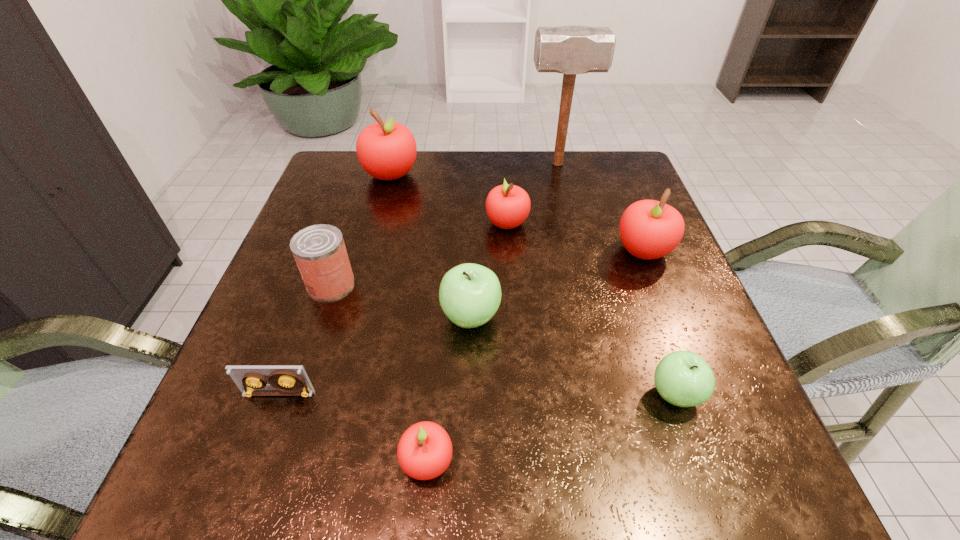
You are a GUI agent. You are given a task and a screenshot of the screen. Output one action in this format:
    pyautogui.click(x=<x>, y=<y>)
    Task: Click on the free space between the farthest red apple and the fifth farthest apple
    The image size is (960, 540).
    Given the screenshot: What is the action you would take?
    [x=533, y=284]

You are a GUI agent. You are given a task and a screenshot of the screen. Output one action in this format:
    pyautogui.click(x=<x>, y=<y>)
    Task: Click on the vacant area that lies between the second red apple from left to right and the fifth farthest apple
    The height and width of the screenshot is (540, 960).
    Given the screenshot: What is the action you would take?
    pyautogui.click(x=551, y=428)

This screenshot has height=540, width=960. I want to click on vacant area that lies between the can and the right green apple, so click(x=503, y=339).

This screenshot has width=960, height=540. Identify the location of vacant space that's between the left green apple and the can. (400, 300).

Where is `free space between the videotape and the smaller green apple`? This screenshot has height=540, width=960. free space between the videotape and the smaller green apple is located at coordinates (477, 394).

Select which object appears as the third closest to the second smallest red apple. Please provide its 2D coordinates. Your answer should be formatted as a tuple, i.e. [(x, y)], where the tuple contains the x and y coordinates of a point satisfying the conditions above.

[(649, 229)]

This screenshot has width=960, height=540. In order to click on object that is the third closest one to the leftmost apple in this screenshot , I will do `click(571, 49)`.

Where is `the fifth closest apple to the can`? the fifth closest apple to the can is located at coordinates (649, 229).

Find the location of `apple that is the fourth nearest to the second red apple from right to left`. apple that is the fourth nearest to the second red apple from right to left is located at coordinates (683, 378).

Locate which red apple ranks second in proximity to the shortest object. Please provide its 2D coordinates. Your answer should be formatted as a tuple, i.e. [(x, y)], where the tuple contains the x and y coordinates of a point satisfying the conditions above.

[(507, 206)]